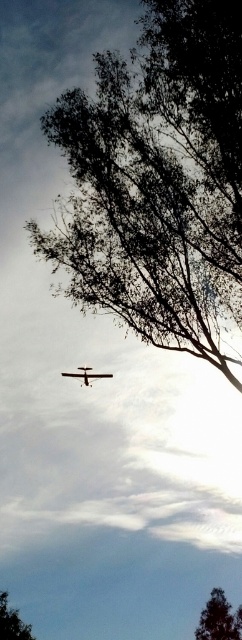
You are an observer standing in the middle of the scene. Which tree, the green leafy tree at lower right or the green leafy tree at lower left, appears bigger to you?

The green leafy tree at lower right appears bigger because it has a larger size compared to the green leafy tree at lower left.

You are a bird flying at an altitude of 30 feet. You want to land on one of the green leafy trees. Which tree would you choose between the green leafy tree at upper center and the green leafy tree at lower right?

The green leafy tree at lower right is closer to your current altitude of 30 feet, so you should choose to land on the green leafy tree at lower right.